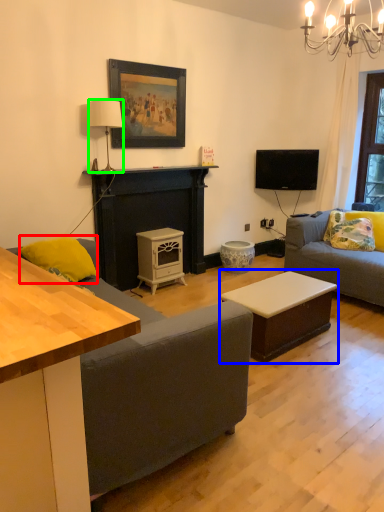
Question: Considering the real-world distances, which object is farthest from pillow (highlighted by a red box)? table (highlighted by a blue box) or lamp (highlighted by a green box)?

Choices:
 (A) table
 (B) lamp

Answer: (A)